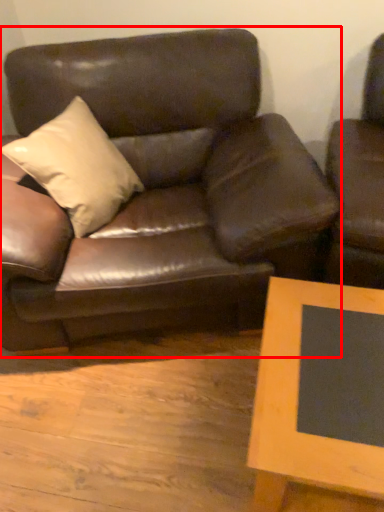
Question: From the image's perspective, what is the correct spatial positioning of studio couch (annotated by the red box) in reference to table?

Choices:
 (A) above
 (B) below

Answer: (A)